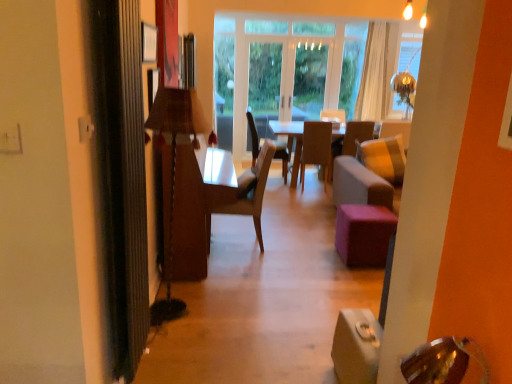
Where is `free space on the front side of wooden lamp at left`? free space on the front side of wooden lamp at left is located at coordinates (186, 333).